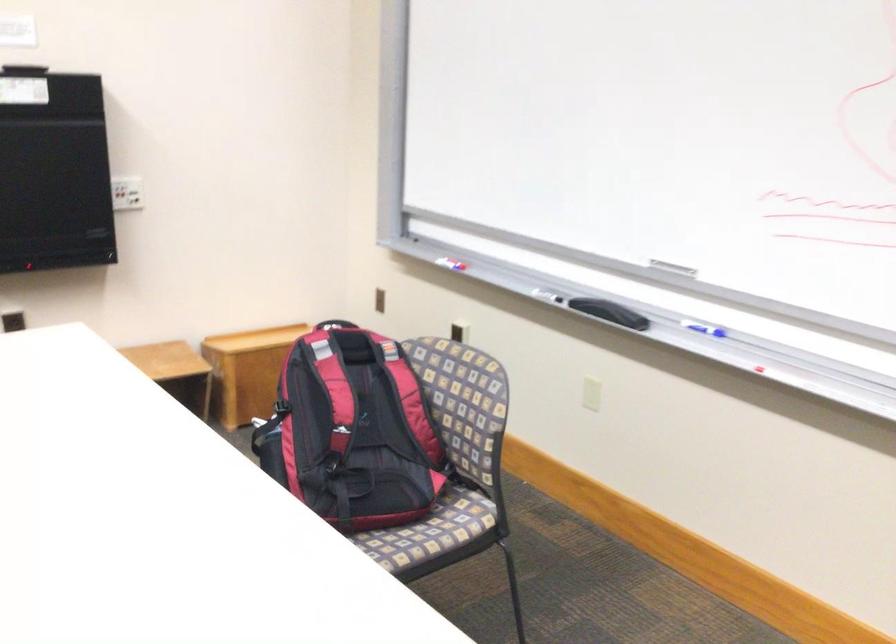
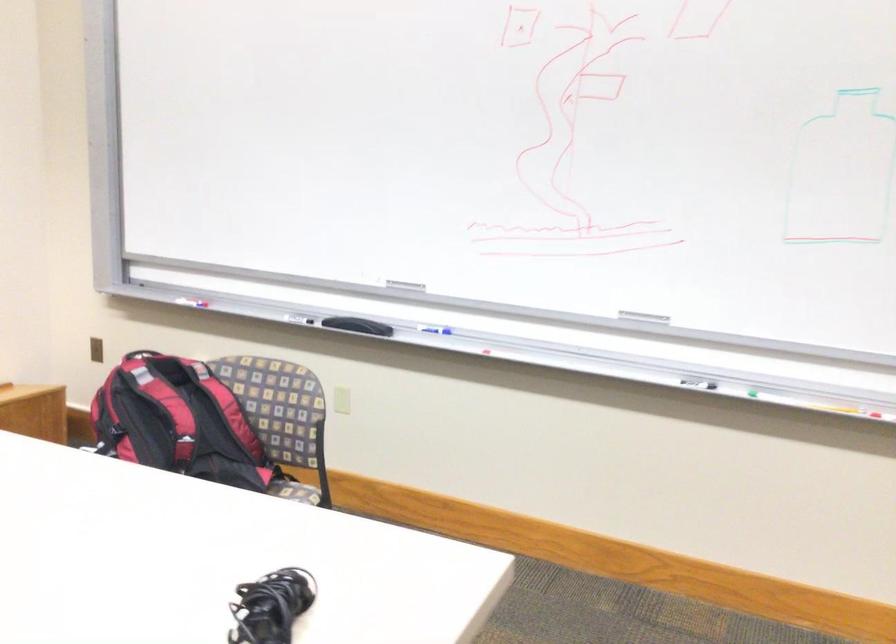
Question: The images are taken continuously from a first-person perspective. In which direction is your viewpoint rotating?

Choices:
 (A) Left
 (B) Right
 (C) Up
 (D) Down

Answer: (B)